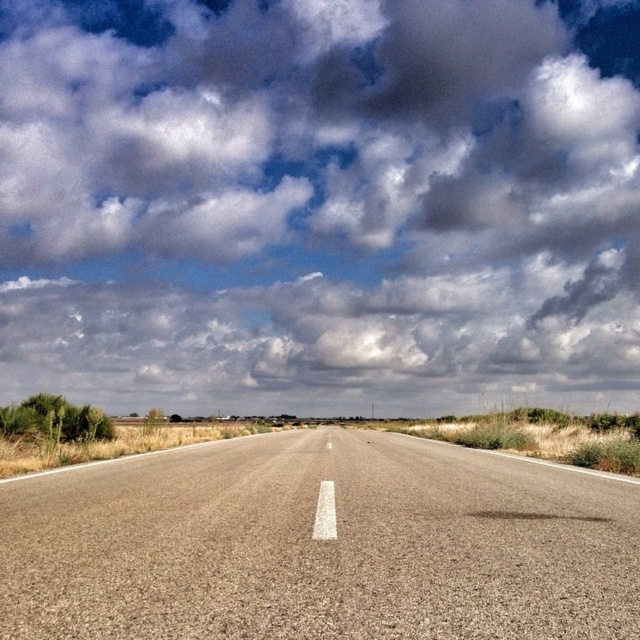
Between point (608, 221) and point (257, 637), which one is positioned in front?

Positioned in front is point (257, 637).

Can you confirm if cloudy sky at upper center is positioned below asphalt road at center?

No.

This screenshot has height=640, width=640. Find the location of `cloudy sky at upper center`. cloudy sky at upper center is located at coordinates (320, 204).

Find the location of `cloudy sky at upper center`. cloudy sky at upper center is located at coordinates (320, 204).